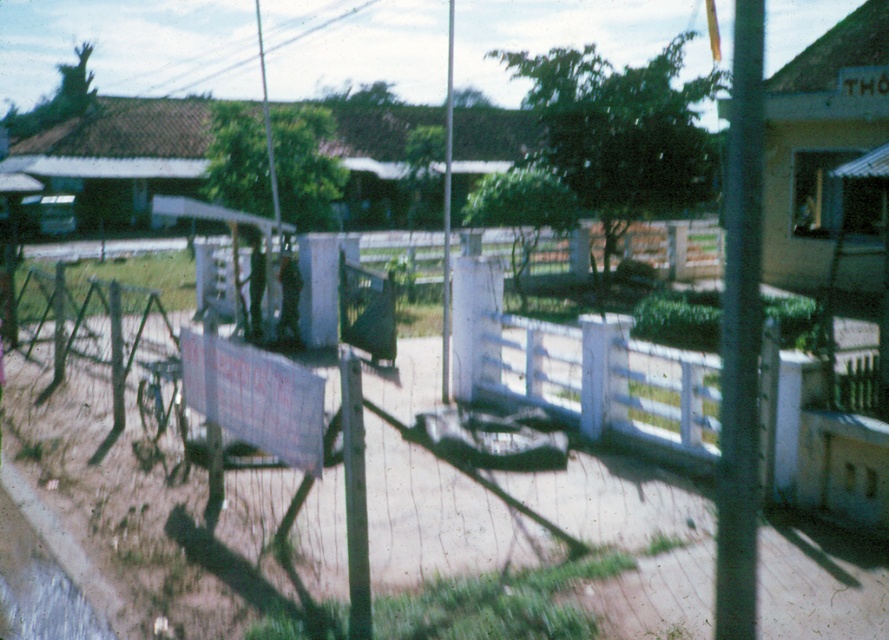
Question: Which point is closer to the camera?

Choices:
 (A) white plastic fence at center
 (B) black metal pole at right

Answer: (B)

Question: Is black metal pole at right further to the viewer compared to white plastic fence at center?

Choices:
 (A) yes
 (B) no

Answer: (B)

Question: Can you confirm if black metal pole at right is thinner than white plastic fence at center?

Choices:
 (A) no
 (B) yes

Answer: (A)

Question: Which object appears closest to the camera in this image?

Choices:
 (A) black metal pole at right
 (B) white plastic fence at center

Answer: (A)

Question: Does black metal pole at right come in front of white plastic fence at center?

Choices:
 (A) no
 (B) yes

Answer: (B)